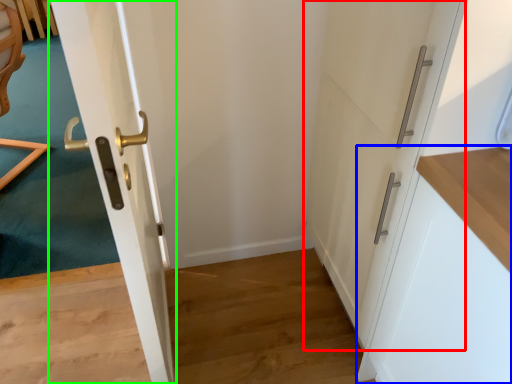
Question: Considering the real-world distances, which object is farthest from door (highlighted by a red box)? cabinetry (highlighted by a blue box) or door (highlighted by a green box)?

Choices:
 (A) cabinetry
 (B) door

Answer: (B)